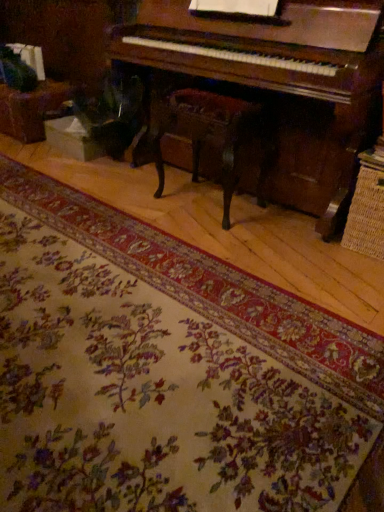
Question: From the image's perspective, is floral carpet at center located above or below wooden polished chair at center?

Choices:
 (A) above
 (B) below

Answer: (B)

Question: Which is correct: floral carpet at center is inside wooden polished chair at center, or outside of it?

Choices:
 (A) inside
 (B) outside

Answer: (B)

Question: From a real-world perspective, is floral carpet at center above or below wooden polished chair at center?

Choices:
 (A) above
 (B) below

Answer: (B)

Question: From the image's perspective, is wooden polished chair at center located above or below floral carpet at center?

Choices:
 (A) below
 (B) above

Answer: (B)

Question: Looking at the image, does wooden polished chair at center seem bigger or smaller compared to floral carpet at center?

Choices:
 (A) small
 (B) big

Answer: (A)

Question: In the image, is wooden polished chair at center positioned in front of or behind floral carpet at center?

Choices:
 (A) behind
 (B) front

Answer: (A)

Question: Do you think wooden polished chair at center is within floral carpet at center, or outside of it?

Choices:
 (A) inside
 (B) outside

Answer: (B)